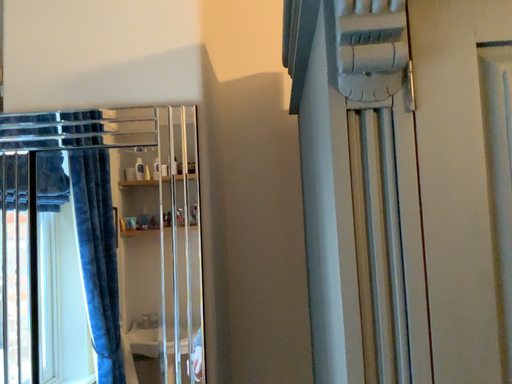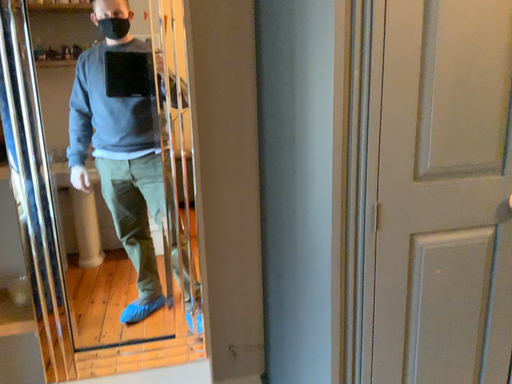
Question: How did the camera likely rotate when shooting the video?

Choices:
 (A) rotated left
 (B) rotated right

Answer: (B)